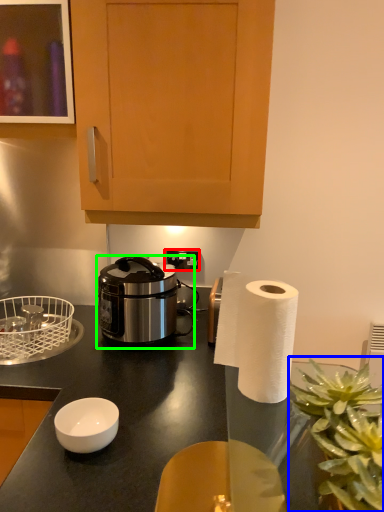
Question: Which object is positioned closest to power outlet (highlighted by a red box)? Select from plant (highlighted by a blue box) and rice cooker (highlighted by a green box).

Choices:
 (A) plant
 (B) rice cooker

Answer: (B)